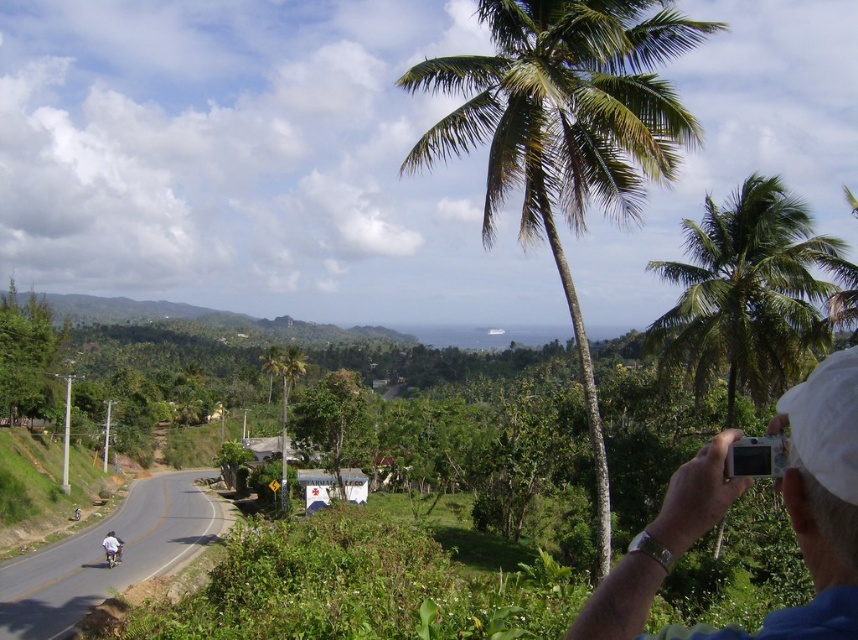
Does green leafy coconut tree at upper center have a greater width compared to white fabric helmet at lower left?

Indeed, green leafy coconut tree at upper center has a greater width compared to white fabric helmet at lower left.

This screenshot has width=858, height=640. In order to click on green leafy coconut tree at upper center in this screenshot , I will do coord(565,132).

Between white cloth cap at upper right and white fabric helmet at lower left, which one has less height?

Standing shorter between the two is white cloth cap at upper right.

Does white cloth cap at upper right appear on the left side of white fabric helmet at lower left?

No, white cloth cap at upper right is not to the left of white fabric helmet at lower left.

Locate an element on the screen. The width and height of the screenshot is (858, 640). white cloth cap at upper right is located at coordinates (817, 502).

Does white cloth cap at upper right lie behind green leafy coconut tree at upper right?

No, white cloth cap at upper right is closer to the viewer.

Is point (856, 388) farther from camera compared to point (770, 205)?

No, it is in front of (770, 205).

Is point (591, 612) in front of point (778, 198)?

Yes, point (591, 612) is in front of point (778, 198).

The height and width of the screenshot is (640, 858). Identify the location of white cloth cap at upper right. (817, 502).